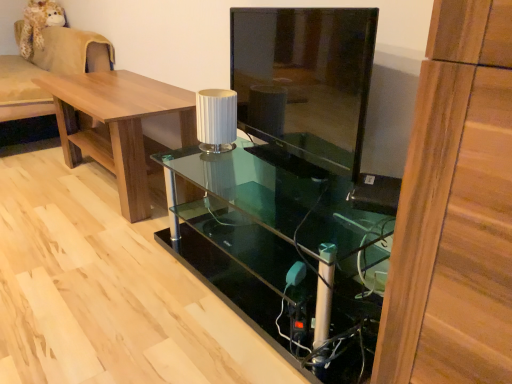
Question: Based on their sizes in the image, would you say transparent glass desk at center is bigger or smaller than white ribbed lampshade at center?

Choices:
 (A) small
 (B) big

Answer: (B)

Question: Is transparent glass desk at center in front of or behind white ribbed lampshade at center in the image?

Choices:
 (A) front
 (B) behind

Answer: (A)

Question: Estimate the real-world distances between objects in this image. Which object is closer to the white ribbed lampshade at center?

Choices:
 (A) brown wood table at left
 (B) transparent glass tv stand at center
 (C) beige fabric couch at left
 (D) transparent glass desk at center

Answer: (B)

Question: Estimate the real-world distances between objects in this image. Which object is farther from the transparent glass tv stand at center?

Choices:
 (A) transparent glass desk at center
 (B) white ribbed lampshade at center
 (C) beige fabric couch at left
 (D) brown wood table at left

Answer: (C)